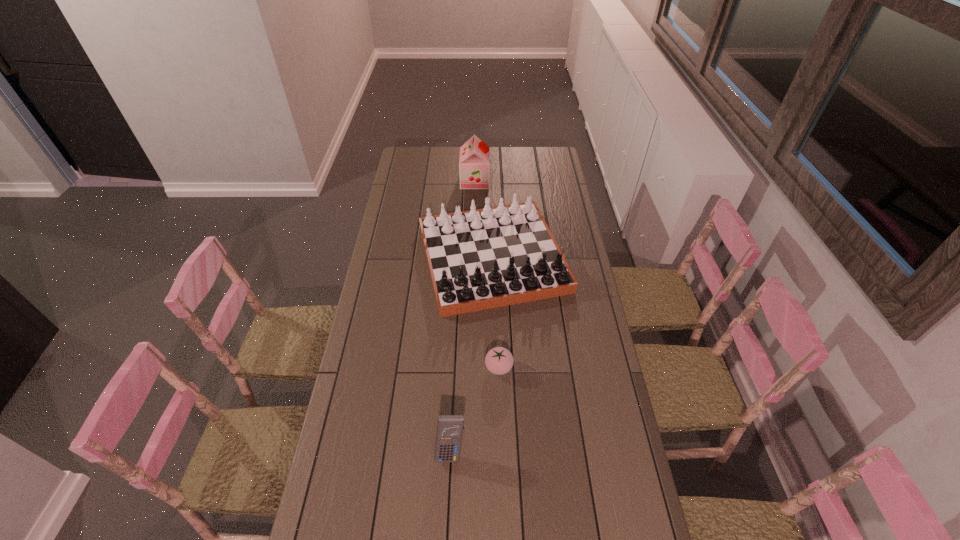
This screenshot has height=540, width=960. What are the coordinates of `the farthest object` in the screenshot? It's located at (474, 163).

Locate an element on the screen. This screenshot has width=960, height=540. soya milk is located at coordinates (474, 163).

The image size is (960, 540). Identify the location of the second farthest object. (480, 259).

Locate an element on the screen. calculator is located at coordinates (450, 428).

The width and height of the screenshot is (960, 540). In order to click on tomato in this screenshot , I will do `click(499, 360)`.

The height and width of the screenshot is (540, 960). Find the location of `the shortest object`. the shortest object is located at coordinates (499, 360).

You are a GUI agent. You are given a task and a screenshot of the screen. Output one action in this format:
    pyautogui.click(x=<x>, y=<y>)
    Task: Click on the vacant space located 0.340m with the cap open on the tallest object
    This screenshot has width=960, height=540.
    Given the screenshot: What is the action you would take?
    [553, 181]

Where is `free spot located on the back of the gameboard`? This screenshot has width=960, height=540. free spot located on the back of the gameboard is located at coordinates (491, 185).

In order to click on free space located 0.140m on the front-facing side of the calculator in this screenshot , I will do `click(447, 517)`.

Find the location of `free space located 0.080m on the right of the tomato`. free space located 0.080m on the right of the tomato is located at coordinates (536, 367).